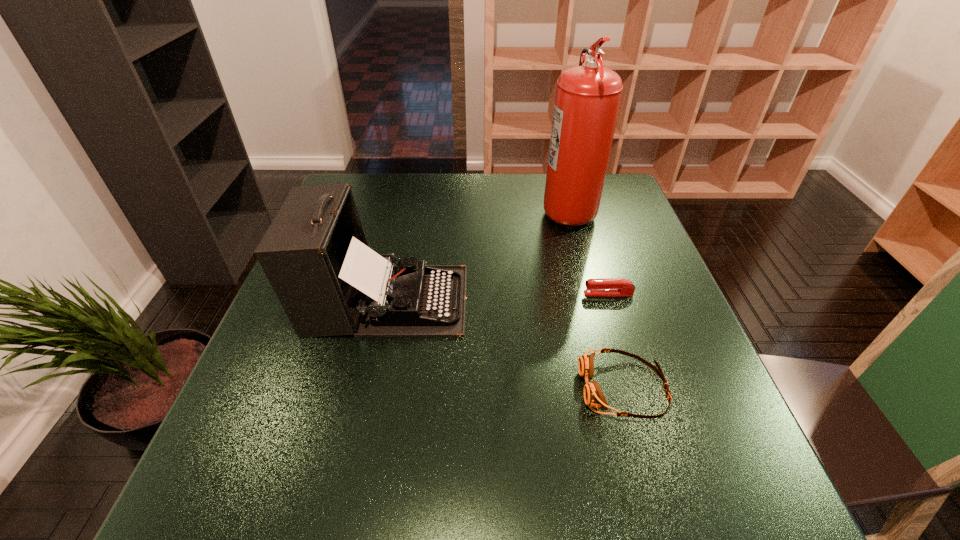
Where is `goggles located at the right edge`? Image resolution: width=960 pixels, height=540 pixels. goggles located at the right edge is located at coordinates (593, 396).

Identify the location of stapler that is at the right edge. (604, 286).

At what (x,y) coordinates should I click in order to perform the action: click on object present at the far right corner. Please return your answer as a coordinate pair (x, y). The image size is (960, 540). Looking at the image, I should click on (587, 100).

Identify the location of free space at the far edge of the desktop. (406, 201).

Identify the location of vacant space at the left edge of the desktop. Image resolution: width=960 pixels, height=540 pixels. (306, 413).

Where is `vacant point at the right edge`? The height and width of the screenshot is (540, 960). vacant point at the right edge is located at coordinates (682, 400).

Where is `vacant space at the far left corner of the desktop`? vacant space at the far left corner of the desktop is located at coordinates (366, 187).

This screenshot has width=960, height=540. I want to click on vacant space at the near left corner of the desktop, so click(261, 502).

The width and height of the screenshot is (960, 540). Identify the location of vacant area that lies between the leftmost object and the tallest object. (477, 254).

The width and height of the screenshot is (960, 540). Identify the location of unoccupied position between the goggles and the farthest object. (595, 298).